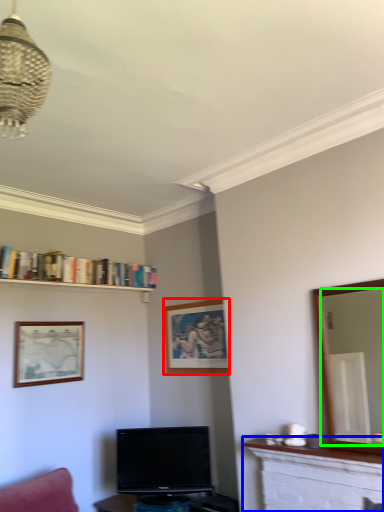
Question: Which is nearer to the picture frame (highlighted by a red box)? fireplace (highlighted by a blue box) or mirror (highlighted by a green box).

Choices:
 (A) fireplace
 (B) mirror

Answer: (A)